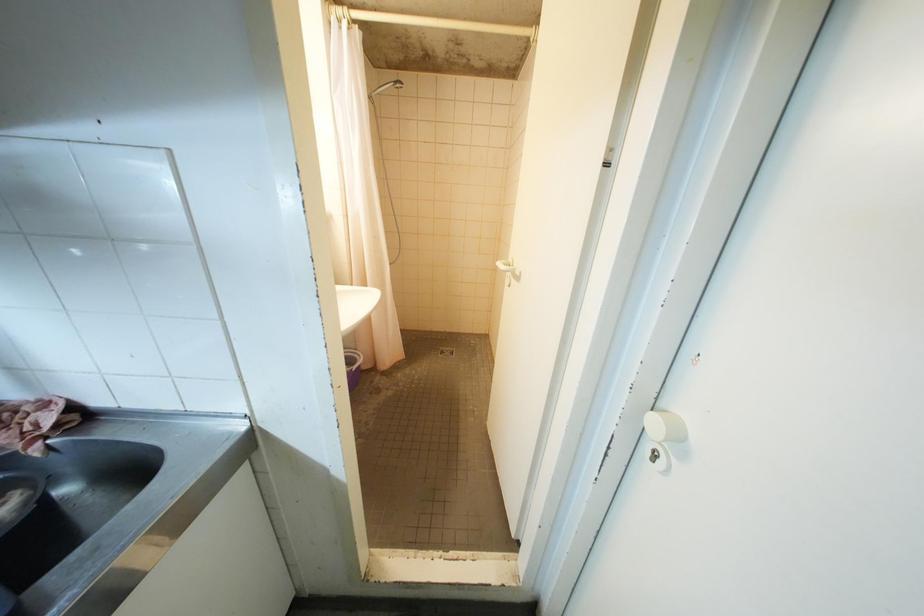
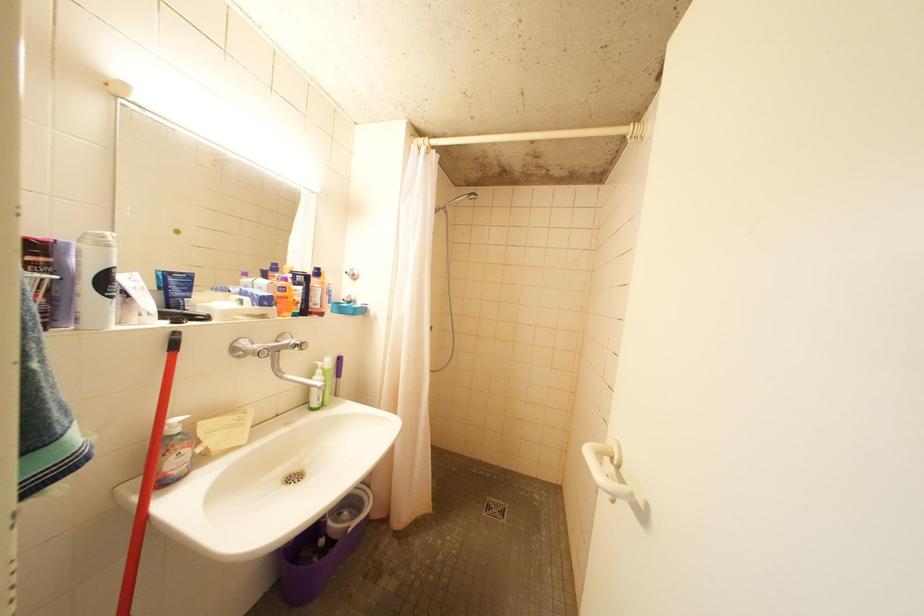
Question: Which direction would the cameraman need to move to produce the second image? Reply with the corresponding letter.

Choices:
 (A) Left
 (B) Right
 (C) Forward
 (D) Backward

Answer: (C)